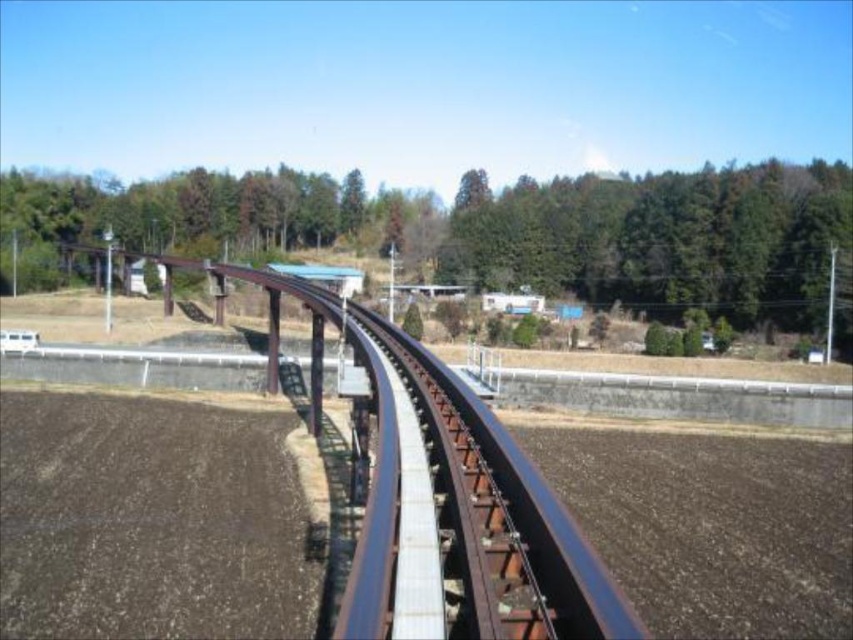
Is green leafy tree at upper center taller than brown soil at lower left?

Yes.

Is green leafy tree at upper center bigger than brown soil at lower left?

Yes, green leafy tree at upper center is bigger than brown soil at lower left.

Between point (505, 252) and point (171, 422), which one is positioned behind?

The point (505, 252) is behind.

Identify the location of green leafy tree at upper center. (505, 230).

Is brown soil at lower left below green leafy trees at upper center?

Yes.

Which is above, brown soil at lower left or green leafy trees at upper center?

Positioned higher is green leafy trees at upper center.

Locate an element on the screen. The image size is (853, 640). brown soil at lower left is located at coordinates (149, 520).

Locate an element on the screen. The width and height of the screenshot is (853, 640). brown soil at lower left is located at coordinates (149, 520).

Is point (192, 221) farther from camera compared to point (585, 259)?

That is True.

Who is more forward, (635, 220) or (566, 259)?

Point (635, 220) is more forward.

What are the coordinates of `green leafy tree at upper center` in the screenshot? It's located at (505, 230).